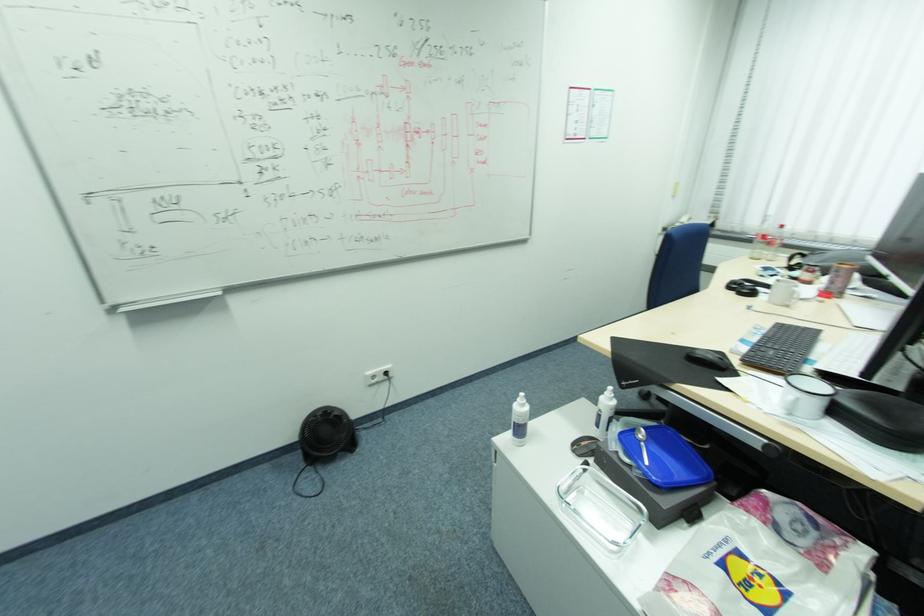
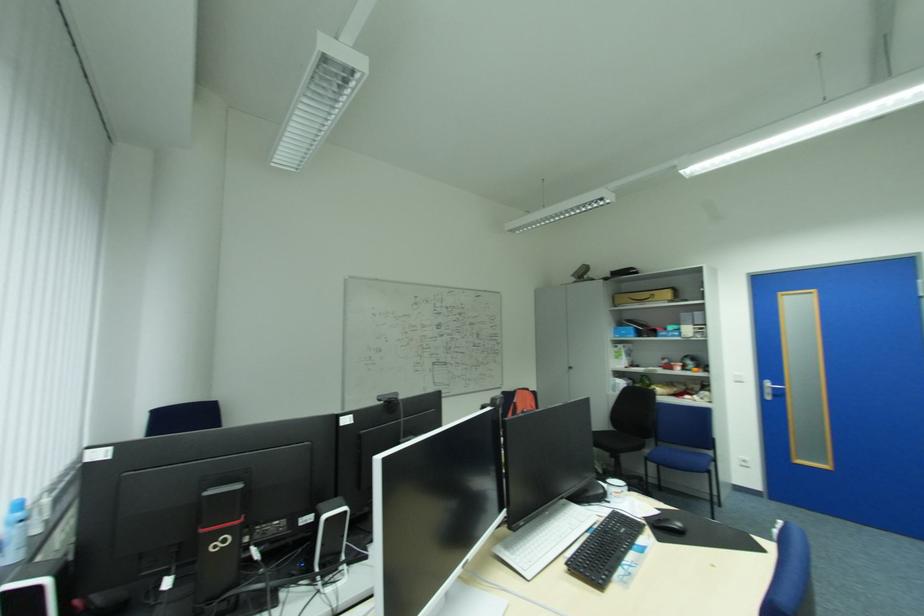
Question: I am providing you with two images of the same scene from different viewpoints. After the viewpoint changes to image2, which objects are now occluded?

Choices:
 (A) black computer mouse
 (B) desk keyhole
 (C) black keyboard
 (D) white mug handle

Answer: (D)